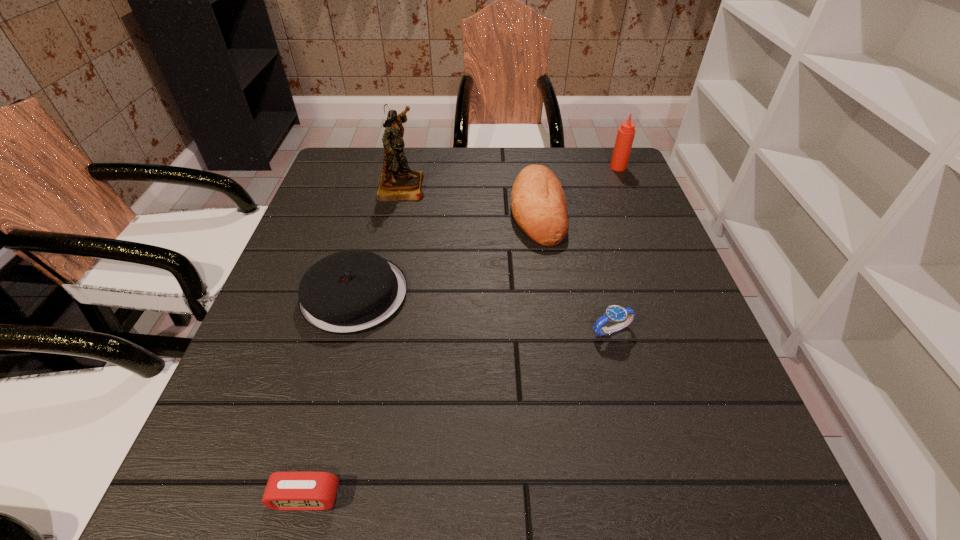
At what (x,y) coordinates should I click in order to perform the action: click on watch positioned at the right edge. Please return your answer as a coordinate pair (x, y). Looking at the image, I should click on (623, 316).

The width and height of the screenshot is (960, 540). What are the coordinates of `object present at the far left corner` in the screenshot? It's located at (398, 182).

Where is `object located at the near left corner`? This screenshot has width=960, height=540. object located at the near left corner is located at coordinates (294, 491).

The height and width of the screenshot is (540, 960). I want to click on object that is at the far right corner, so click(x=626, y=132).

The width and height of the screenshot is (960, 540). In the image, there is a desktop. What are the coordinates of `blank space at the far edge` in the screenshot? It's located at (444, 147).

Find the location of a particular element. Image resolution: width=960 pixels, height=540 pixels. vacant space at the near edge of the desktop is located at coordinates (435, 496).

Locate an element on the screen. The width and height of the screenshot is (960, 540). free space at the left edge of the desktop is located at coordinates (289, 284).

The width and height of the screenshot is (960, 540). I want to click on vacant space at the right edge of the desktop, so click(x=638, y=251).

In the image, there is a desktop. At what (x,y) coordinates should I click in order to perform the action: click on vacant space at the far right corner. Please return your answer as a coordinate pair (x, y). Looking at the image, I should click on (577, 159).

Locate an element on the screen. empty space that is in between the alarm clock and the pancake is located at coordinates (330, 396).